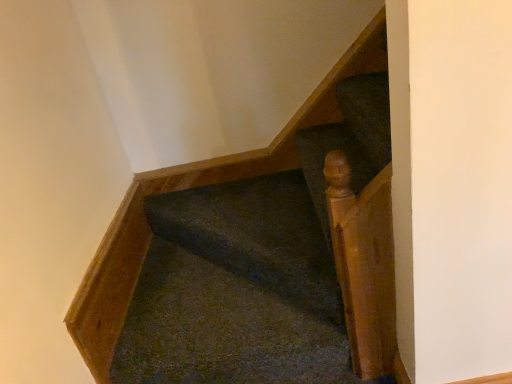
From the picture: Measure the distance between dark green carpet at center and camera.

3.70 feet.

At what (x,y) coordinates should I click in order to perform the action: click on dark green carpet at center. Please return your answer as a coordinate pair (x, y). The image size is (512, 384). Looking at the image, I should click on (253, 267).

The image size is (512, 384). Describe the element at coordinates (253, 267) in the screenshot. I see `dark green carpet at center` at that location.

Where is `light brown polished wood handrail at upper right`? The height and width of the screenshot is (384, 512). light brown polished wood handrail at upper right is located at coordinates (364, 264).

Describe the element at coordinates (364, 264) in the screenshot. I see `light brown polished wood handrail at upper right` at that location.

Image resolution: width=512 pixels, height=384 pixels. What are the coordinates of `dark green carpet at center` in the screenshot? It's located at (253, 267).

Is light brown polished wood handrail at upper right to the right of dark green carpet at center from the viewer's perspective?

Correct, you'll find light brown polished wood handrail at upper right to the right of dark green carpet at center.

Does light brown polished wood handrail at upper right come in front of dark green carpet at center?

Yes.

From the picture: Which point is more forward, (344, 307) or (289, 306)?

The point (344, 307) is more forward.

From the image's perspective, who appears lower, light brown polished wood handrail at upper right or dark green carpet at center?

light brown polished wood handrail at upper right is shown below in the image.

From a real-world perspective, does light brown polished wood handrail at upper right stand above dark green carpet at center?

Yes.

Which of these two, light brown polished wood handrail at upper right or dark green carpet at center, is thinner?

With smaller width is light brown polished wood handrail at upper right.

Can you confirm if light brown polished wood handrail at upper right is taller than dark green carpet at center?

Yes.

From the picture: Who is smaller, light brown polished wood handrail at upper right or dark green carpet at center?

With smaller size is light brown polished wood handrail at upper right.

Is dark green carpet at center located within light brown polished wood handrail at upper right?

No, dark green carpet at center is not inside light brown polished wood handrail at upper right.

Is light brown polished wood handrail at upper right touching dark green carpet at center?

light brown polished wood handrail at upper right is not next to dark green carpet at center, and they're not touching.

Is dark green carpet at center at the back of light brown polished wood handrail at upper right?

No, light brown polished wood handrail at upper right's orientation is not away from dark green carpet at center.

Image resolution: width=512 pixels, height=384 pixels. In order to click on stairs above the light brown polished wood handrail at upper right (from the image's perspective) in this screenshot , I will do click(x=253, y=267).

Which object is positioned more to the left, dark green carpet at center or light brown polished wood handrail at upper right?

Positioned to the left is dark green carpet at center.

Considering the positions of objects dark green carpet at center and light brown polished wood handrail at upper right in the image provided, who is behind, dark green carpet at center or light brown polished wood handrail at upper right?

dark green carpet at center is further from the camera.

Is point (330, 381) less distant than point (390, 172)?

No, (330, 381) is further to viewer.

From the image's perspective, is dark green carpet at center located beneath light brown polished wood handrail at upper right?

Incorrect, from the image's perspective, dark green carpet at center is higher than light brown polished wood handrail at upper right.

From a real-world perspective, relative to light brown polished wood handrail at upper right, is dark green carpet at center vertically above or below?

In terms of real-world spatial position, dark green carpet at center is below light brown polished wood handrail at upper right.

Can you confirm if dark green carpet at center is thinner than light brown polished wood handrail at upper right?

No.

Is dark green carpet at center taller than light brown polished wood handrail at upper right?

Incorrect, the height of dark green carpet at center is not larger of that of light brown polished wood handrail at upper right.

Who is smaller, dark green carpet at center or light brown polished wood handrail at upper right?

Smaller between the two is light brown polished wood handrail at upper right.

Is dark green carpet at center inside the boundaries of light brown polished wood handrail at upper right, or outside?

The correct answer is: outside.

Is there a large distance between dark green carpet at center and light brown polished wood handrail at upper right?

No, there isn't a large distance between dark green carpet at center and light brown polished wood handrail at upper right.

Is dark green carpet at center facing away from light brown polished wood handrail at upper right?

That's not correct — dark green carpet at center is not looking away from light brown polished wood handrail at upper right.

What's the angular difference between dark green carpet at center and light brown polished wood handrail at upper right's facing directions?

They differ by 44.4 degrees in their facing directions.

The image size is (512, 384). In order to click on rail above the dark green carpet at center (from a real-world perspective) in this screenshot , I will do `click(364, 264)`.

Find the location of `stairs that appears behind the light brown polished wood handrail at upper right`. stairs that appears behind the light brown polished wood handrail at upper right is located at coordinates (253, 267).

Where is `stairs on the left side of light brown polished wood handrail at upper right`? stairs on the left side of light brown polished wood handrail at upper right is located at coordinates (253, 267).